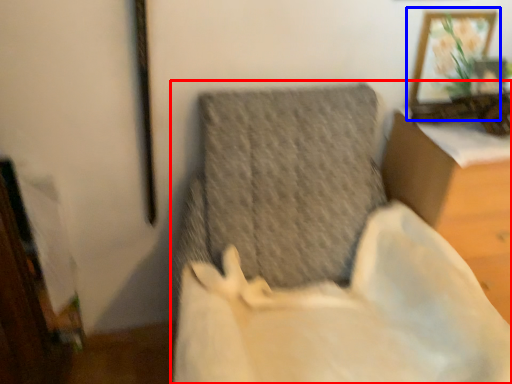
Question: Which object appears closest to the camera in this image, furniture (highlighted by a red box) or picture frame (highlighted by a blue box)?

Choices:
 (A) furniture
 (B) picture frame

Answer: (A)